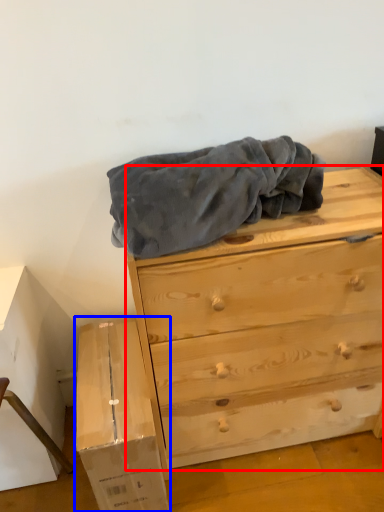
Question: Which of the following is the farthest to the observer, chest of drawers (highlighted by a red box) or cardboard box (highlighted by a blue box)?

Choices:
 (A) chest of drawers
 (B) cardboard box

Answer: (B)